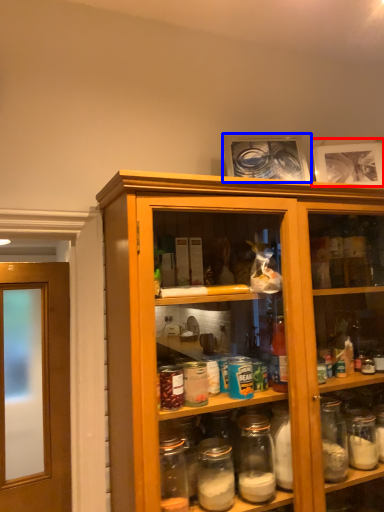
Question: Which point is further to the camera, picture frame (highlighted by a red box) or picture frame (highlighted by a blue box)?

Choices:
 (A) picture frame
 (B) picture frame

Answer: (A)